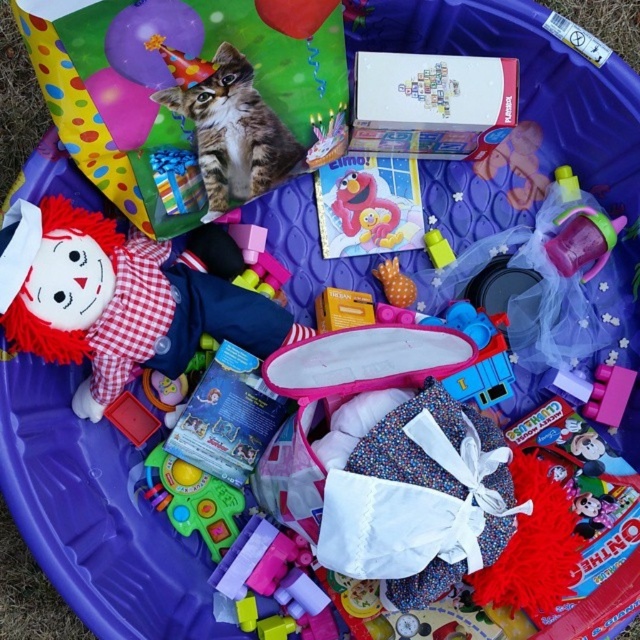
From the picture: You are a child who wants to reach for the translucent plastic cup at center without disturbing the tabby fur cat at upper left. Which object should you move first to create space?

The tabby fur cat at upper left is much taller than the translucent plastic cup at center, so you should move the tabby fur cat at upper left first to create space.

Looking at this image, you are a parent trying to decide which toy to give your child first. You see the rubberized plastic toy at center and the orange dotted fabric at center. Which one is taller?

The rubberized plastic toy at center is taller than the orange dotted fabric at center.

You are a child who wants to grab the translucent plastic cup at center from the pool. The tabby fur cat at upper left is blocking your path. Can you reach the cup without moving the cat?

The tabby fur cat at upper left is above the translucent plastic cup at center, so you can reach the cup without moving the cat because the cat is positioned higher up and not directly in front of it.